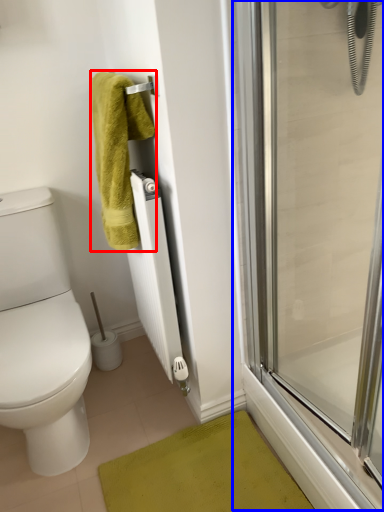
Question: Which of the following is the farthest to the observer, towel (highlighted by a red box) or screen door (highlighted by a blue box)?

Choices:
 (A) towel
 (B) screen door

Answer: (A)